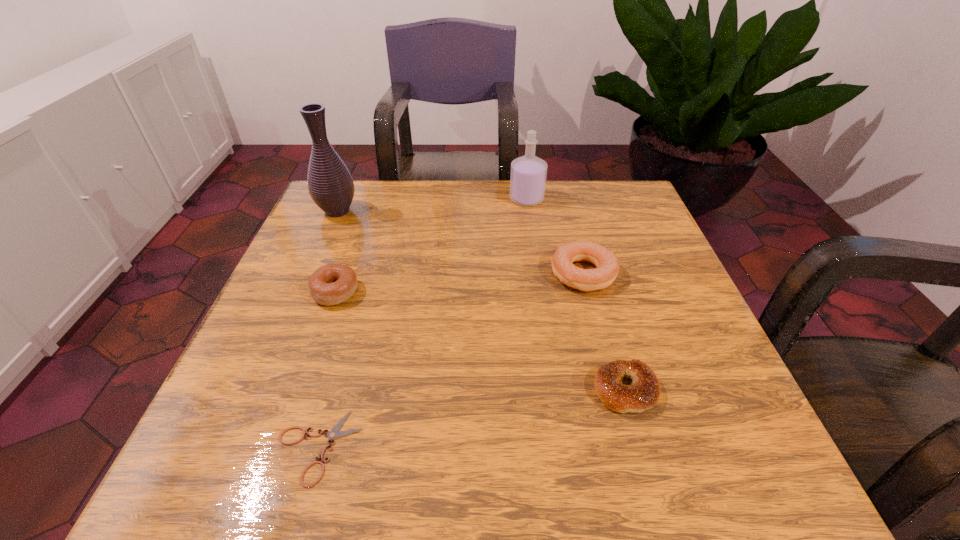
This screenshot has height=540, width=960. I want to click on vacant point at the near edge, so click(x=350, y=451).

The width and height of the screenshot is (960, 540). What are the coordinates of `vacant position at the left edge of the desktop` in the screenshot? It's located at (334, 330).

Image resolution: width=960 pixels, height=540 pixels. I want to click on free space at the right edge of the desktop, so click(649, 273).

The width and height of the screenshot is (960, 540). Find the location of `free region at the far left corner`. free region at the far left corner is located at coordinates (317, 221).

You are a GUI agent. You are given a task and a screenshot of the screen. Output one action in this format:
    pyautogui.click(x=<x>, y=<y>)
    Task: Click on the free space at the near left corner of the desktop
    This screenshot has height=540, width=960.
    Given the screenshot: What is the action you would take?
    pyautogui.click(x=268, y=472)

I want to click on free space at the far right corner, so 604,229.

The image size is (960, 540). In order to click on free space at the near right corner of the desktop in this screenshot , I will do `click(695, 488)`.

Find the location of a particular element. The image size is (960, 540). free space between the second tallest object and the leftmost bagel is located at coordinates (431, 246).

This screenshot has height=540, width=960. Identify the location of unoccupied position between the shortest bagel and the fifth shortest object. (576, 294).

At what (x,y) coordinates should I click in order to perform the action: click on free space between the second shortest object and the vase. Please return your answer as a coordinate pair (x, y). Looking at the image, I should click on (481, 300).